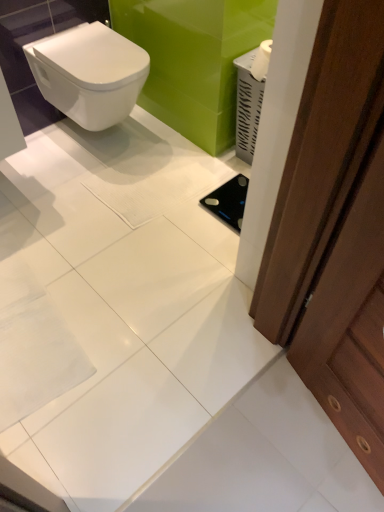
Question: Is brown wooden door at right bigger than white glossy toilet at upper left?

Choices:
 (A) yes
 (B) no

Answer: (B)

Question: Is brown wooden door at right facing away from white glossy toilet at upper left?

Choices:
 (A) no
 (B) yes

Answer: (A)

Question: Is brown wooden door at right shorter than white glossy toilet at upper left?

Choices:
 (A) yes
 (B) no

Answer: (B)

Question: From a real-world perspective, is brown wooden door at right on top of white glossy toilet at upper left?

Choices:
 (A) no
 (B) yes

Answer: (B)

Question: Can you confirm if brown wooden door at right is wider than white glossy toilet at upper left?

Choices:
 (A) no
 (B) yes

Answer: (A)

Question: Could you tell me if brown wooden door at right is turned towards white glossy toilet at upper left?

Choices:
 (A) no
 (B) yes

Answer: (A)

Question: Is brown wooden door at right completely or partially inside white glossy toilet at upper left?

Choices:
 (A) no
 (B) yes

Answer: (A)

Question: Is white glossy toilet at upper left closer to camera compared to brown wooden door at right?

Choices:
 (A) yes
 (B) no

Answer: (B)

Question: Is the surface of white glossy toilet at upper left in direct contact with brown wooden door at right?

Choices:
 (A) no
 (B) yes

Answer: (A)

Question: Is white glossy toilet at upper left outside of brown wooden door at right?

Choices:
 (A) no
 (B) yes

Answer: (B)

Question: Considering the relative sizes of white glossy toilet at upper left and brown wooden door at right in the image provided, is white glossy toilet at upper left bigger than brown wooden door at right?

Choices:
 (A) yes
 (B) no

Answer: (A)

Question: Is white glossy toilet at upper left oriented away from brown wooden door at right?

Choices:
 (A) yes
 (B) no

Answer: (B)

Question: Relative to brown wooden door at right, is white glossy toilet at upper left in front or behind?

Choices:
 (A) front
 (B) behind

Answer: (B)